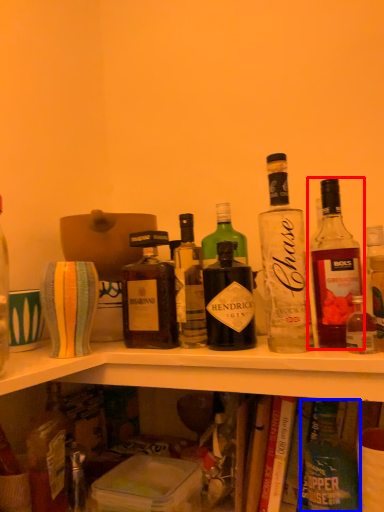
Question: Among these objects, which one is farthest to the camera, bottle (highlighted by a red box) or bottle (highlighted by a blue box)?

Choices:
 (A) bottle
 (B) bottle

Answer: (B)